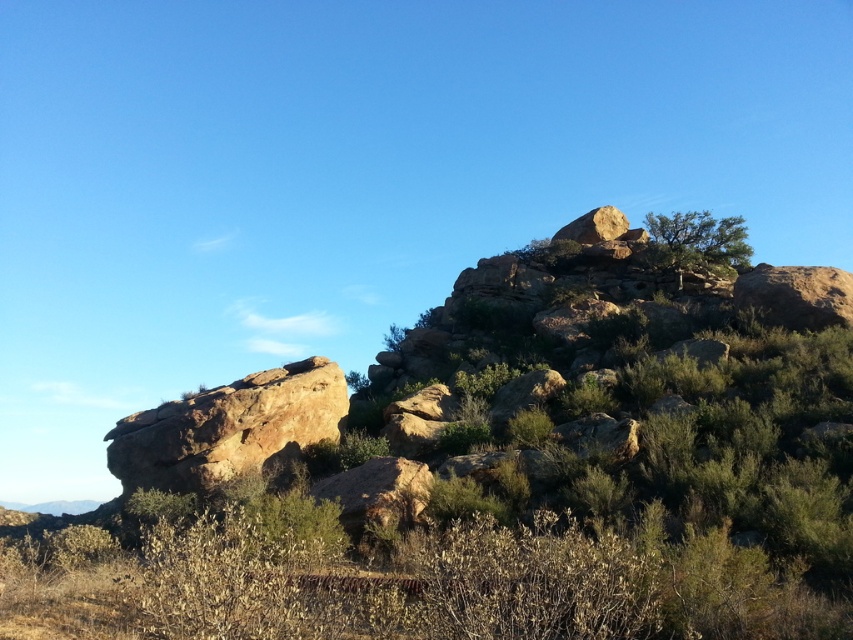
Question: Is green shrubbery at upper center wider than green leafy shrub at upper right?

Choices:
 (A) no
 (B) yes

Answer: (B)

Question: In this image, where is green shrubbery at upper center located relative to green leafy shrub at upper right?

Choices:
 (A) left
 (B) right

Answer: (A)

Question: Among these points, which one is nearest to the camera?

Choices:
 (A) 699,252
 (B) 729,436

Answer: (B)

Question: Which point is farther from the camera taking this photo?

Choices:
 (A) (431, 564)
 (B) (700, 230)

Answer: (B)

Question: Which object appears farthest from the camera in this image?

Choices:
 (A) green leafy shrub at upper right
 (B) green shrubbery at upper center

Answer: (A)

Question: Can you confirm if green shrubbery at upper center is positioned to the right of green leafy shrub at upper right?

Choices:
 (A) no
 (B) yes

Answer: (A)